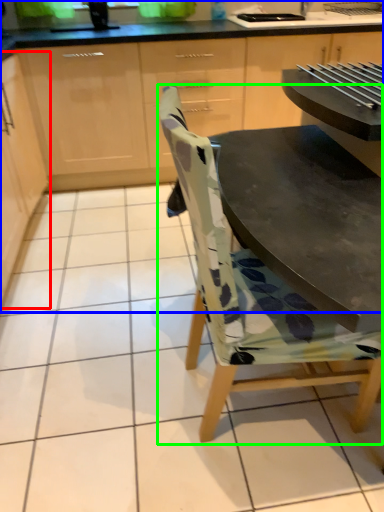
Question: Which object is positioned closest to cabinetry (highlighted by a red box)? Select from cabinetry (highlighted by a blue box) and chair (highlighted by a green box).

Choices:
 (A) cabinetry
 (B) chair

Answer: (A)